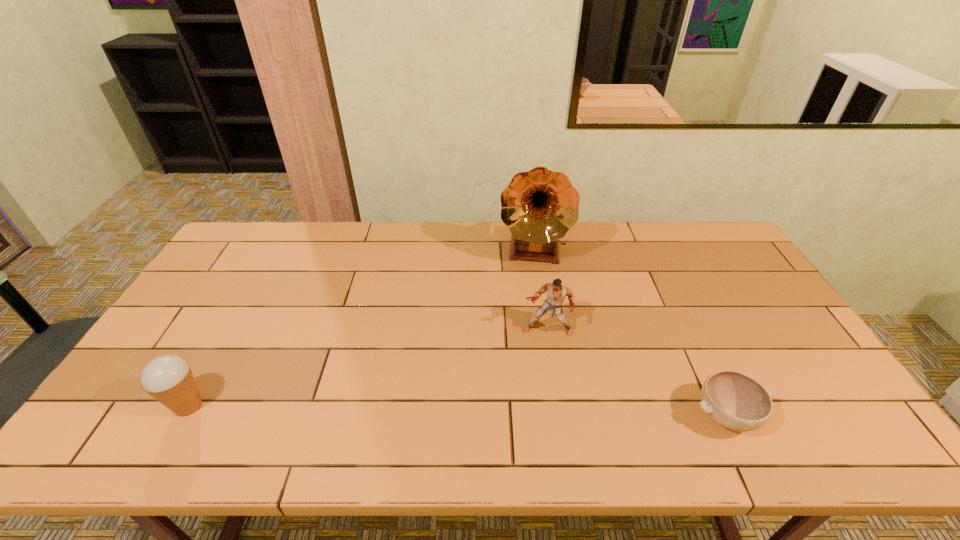
This screenshot has width=960, height=540. Find the location of `vacant region between the puncher and the shortest object`. vacant region between the puncher and the shortest object is located at coordinates (636, 373).

Locate an element on the screen. free space that is in between the icecream and the third nearest object is located at coordinates (368, 368).

Find the location of a particular element. The image size is (960, 540). empty space between the farthest object and the icecream is located at coordinates [360, 328].

What are the coordinates of `free space between the leftmost object and the third nearest object` in the screenshot? It's located at (368, 368).

Point out which object is positioned as the third nearest to the farthest object. Please provide its 2D coordinates. Your answer should be formatted as a tuple, i.e. [(x, y)], where the tuple contains the x and y coordinates of a point satisfying the conditions above.

[(169, 379)]

This screenshot has width=960, height=540. I want to click on the second closest object to the leftmost object, so click(x=539, y=207).

Identify the location of free space that satisfies the following two spatial constraints: 1. on the front side of the bowl; 2. on the right side of the farthest object. The width and height of the screenshot is (960, 540). 555,416.

I want to click on free spot that satisfies the following two spatial constraints: 1. on the front side of the bowl; 2. on the left side of the second farthest object, so click(x=561, y=416).